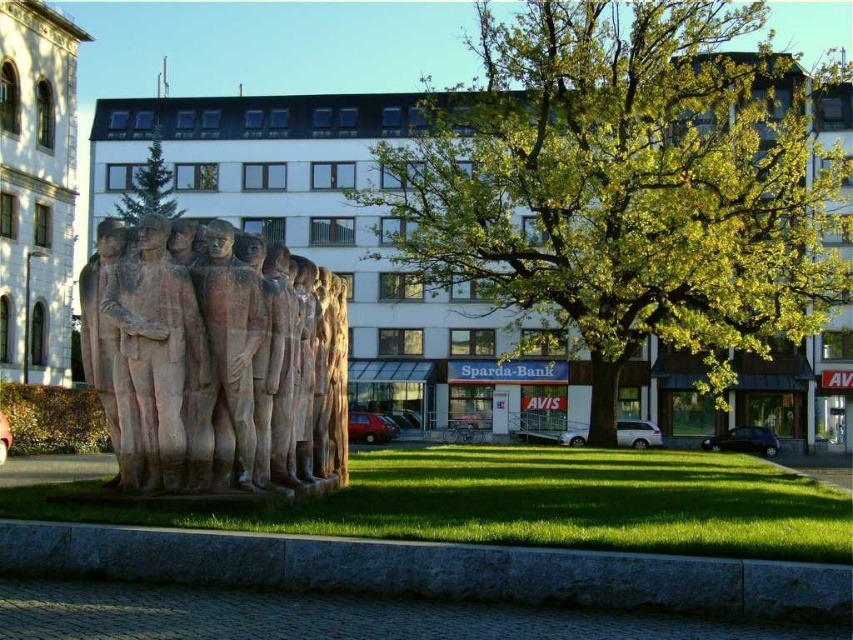
Question: Among these points, which one is farthest from the camera?

Choices:
 (A) (334, 454)
 (B) (155, 179)
 (C) (242, 349)

Answer: (B)

Question: Which object appears closest to the camera in this image?

Choices:
 (A) rustic stone sculpture at center
 (B) green leafy tree at center
 (C) smooth stone statue at center

Answer: (A)

Question: Which object appears farthest from the camera in this image?

Choices:
 (A) rustic stone statues at center
 (B) smooth stone statue at center
 (C) green leafy tree at upper center
 (D) rustic stone sculpture at center

Answer: (C)

Question: Is green leafy tree at center smaller than rustic stone sculpture at center?

Choices:
 (A) no
 (B) yes

Answer: (A)

Question: Can you confirm if rustic stone sculpture at center is smaller than smooth stone statue at center?

Choices:
 (A) no
 (B) yes

Answer: (A)

Question: Does green leafy tree at center appear under rustic stone statues at center?

Choices:
 (A) yes
 (B) no

Answer: (B)